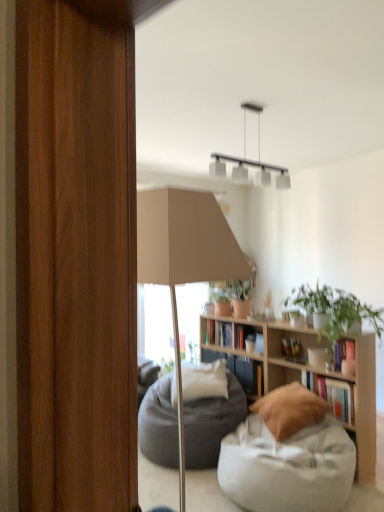
Question: Considering the positions of brown suede pillow at lower center, acting as the first pillow starting from the right, and dark gray fabric bean bag at center in the image, is brown suede pillow at lower center, acting as the first pillow starting from the right, taller or shorter than dark gray fabric bean bag at center?

Choices:
 (A) tall
 (B) short

Answer: (B)

Question: From a real-world perspective, is brown suede pillow at lower center, acting as the second pillow starting from the back, positioned above or below dark gray fabric bean bag at center?

Choices:
 (A) below
 (B) above

Answer: (B)

Question: Which object is the closest to the dark gray fabric bean bag at center?

Choices:
 (A) hardcover book at center, acting as the first book starting from the back
 (B) green matte plant at upper right
 (C) white soft pillow at center, which appears as the second pillow when viewed from the right
 (D) white fabric bean bag at lower right
 (E) hardcover book at center, which ranks as the second book in left-to-right order

Answer: (C)

Question: Which is nearer to the wooden bookshelf at center?

Choices:
 (A) green matte plant at upper right
 (B) hardcover book at center, which ranks as the 2th book in front-to-back order
 (C) hardcover book at center, which is the 1th book in right-to-left order
 (D) brown suede pillow at lower center, acting as the first pillow starting from the right
 (E) hardcover book at center, acting as the first book starting from the back

Answer: (C)